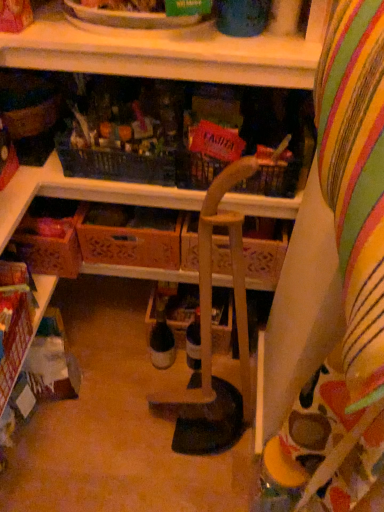
Question: Is wooden crate at lower left, marked as the second shelf in a top-to-bottom arrangement, not close to wooden at upper center, the 2th shelf when ordered from bottom to top?

Choices:
 (A) yes
 (B) no

Answer: (B)

Question: From a real-world perspective, is wooden crate at lower left, which is counted as the second shelf, starting from the right, on wooden at upper center, the 2th shelf when ordered from bottom to top?

Choices:
 (A) yes
 (B) no

Answer: (B)

Question: Considering the relative sizes of wooden crate at lower left, which ranks as the first shelf in left-to-right order, and wooden at upper center, placed as the 1th shelf when sorted from top to bottom, in the image provided, is wooden crate at lower left, which ranks as the first shelf in left-to-right order, smaller than wooden at upper center, placed as the 1th shelf when sorted from top to bottom,?

Choices:
 (A) yes
 (B) no

Answer: (A)

Question: Does wooden crate at lower left, which ranks as the first shelf in left-to-right order, lie behind wooden at upper center, the 2th shelf when ordered from bottom to top?

Choices:
 (A) yes
 (B) no

Answer: (A)

Question: Considering the relative positions of wooden crate at lower left, which ranks as the first shelf in left-to-right order, and wooden at upper center, which is counted as the second shelf, starting from the left, in the image provided, is wooden crate at lower left, which ranks as the first shelf in left-to-right order, to the right of wooden at upper center, which is counted as the second shelf, starting from the left, from the viewer's perspective?

Choices:
 (A) yes
 (B) no

Answer: (B)

Question: Does wooden crate at lower left, which ranks as the first shelf in left-to-right order, turn towards wooden at upper center, which is counted as the second shelf, starting from the left?

Choices:
 (A) no
 (B) yes

Answer: (A)

Question: Is wooden crate at lower left, the 1th shelf ordered from the bottom, surrounding wooden crate at lower left, acting as the first drawer starting from the left?

Choices:
 (A) no
 (B) yes

Answer: (A)

Question: Is wooden crate at lower left, marked as the second shelf in a top-to-bottom arrangement, further to camera compared to wooden crate at lower left, acting as the first drawer starting from the left?

Choices:
 (A) no
 (B) yes

Answer: (A)

Question: From the image's perspective, is wooden crate at lower left, marked as the second shelf in a top-to-bottom arrangement, under wooden crate at lower left, the 2th drawer when ordered from right to left?

Choices:
 (A) no
 (B) yes

Answer: (B)

Question: Considering the relative sizes of wooden crate at lower left, which ranks as the first shelf in left-to-right order, and wooden crate at lower left, acting as the first drawer starting from the left, in the image provided, is wooden crate at lower left, which ranks as the first shelf in left-to-right order, taller than wooden crate at lower left, acting as the first drawer starting from the left,?

Choices:
 (A) yes
 (B) no

Answer: (B)

Question: From a real-world perspective, is wooden crate at lower left, which is counted as the second shelf, starting from the right, on top of wooden crate at lower left, acting as the first drawer starting from the left?

Choices:
 (A) no
 (B) yes

Answer: (A)

Question: Does wooden crate at lower left, which is counted as the second shelf, starting from the right, appear on the right side of wooden crate at lower left, the 2th drawer when ordered from right to left?

Choices:
 (A) yes
 (B) no

Answer: (B)

Question: From the image's perspective, would you say wooden chair at center is shown under wooden at upper center, the 2th shelf when ordered from bottom to top?

Choices:
 (A) yes
 (B) no

Answer: (A)